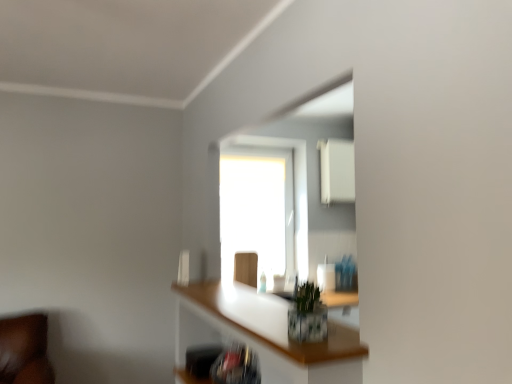
The image size is (512, 384). Find the location of `wooden swivel chair at center`. wooden swivel chair at center is located at coordinates [x=246, y=268].

Identify the location of transparent glass window at center. (258, 212).

At what (x,y) coordinates should I click in order to perform the action: click on wooden swivel chair at center. Please return your answer as a coordinate pair (x, y). The image size is (512, 384). Looking at the image, I should click on (246, 268).

Consider the image. Between translucent glass shelf at center and green leafy plant at center, which one has smaller size?

green leafy plant at center is smaller.

From the image's perspective, relative to green leafy plant at center, is translucent glass shelf at center above or below?

Based on their image positions, translucent glass shelf at center is located beneath green leafy plant at center.

In terms of height, does translucent glass shelf at center look taller or shorter compared to green leafy plant at center?

translucent glass shelf at center is taller than green leafy plant at center.

Between translucent glass shelf at center and green leafy plant at center, which one has smaller width?

With smaller width is green leafy plant at center.

Does wooden swivel chair at center appear on the left side of green leafy plant at center?

Correct, you'll find wooden swivel chair at center to the left of green leafy plant at center.

Looking at their sizes, would you say wooden swivel chair at center is wider or thinner than green leafy plant at center?

Considering their sizes, wooden swivel chair at center looks slimmer than green leafy plant at center.

The height and width of the screenshot is (384, 512). I want to click on plant that is in front of the wooden swivel chair at center, so click(x=307, y=315).

Looking at the image, does wooden swivel chair at center seem bigger or smaller compared to green leafy plant at center?

Considering their sizes, wooden swivel chair at center takes up more space than green leafy plant at center.

Which is more to the right, translucent glass shelf at center or transparent glass window at center?

From the viewer's perspective, translucent glass shelf at center appears more on the right side.

Is transparent glass window at center located within translucent glass shelf at center?

No, transparent glass window at center is not surrounded by translucent glass shelf at center.

Is translucent glass shelf at center turned away from transparent glass window at center?

No, translucent glass shelf at center's orientation is not away from transparent glass window at center.

Is translucent glass shelf at center thinner than transparent glass window at center?

No, translucent glass shelf at center is not thinner than transparent glass window at center.

Is green leafy plant at center in contact with translucent glass shelf at center?

No, green leafy plant at center is not next to translucent glass shelf at center.

Relative to translucent glass shelf at center, is green leafy plant at center in front or behind?

Clearly, green leafy plant at center is behind translucent glass shelf at center.

From the picture: From the image's perspective, is green leafy plant at center above translucent glass shelf at center?

Yes, from the image's perspective, green leafy plant at center is above translucent glass shelf at center.

Based on their sizes in the image, would you say green leafy plant at center is bigger or smaller than translucent glass shelf at center?

In the image, green leafy plant at center appears to be smaller than translucent glass shelf at center.

Is green leafy plant at center with transparent glass window at center?

No, green leafy plant at center is not next to transparent glass window at center.

Which of these two, green leafy plant at center or transparent glass window at center, is bigger?

With larger size is transparent glass window at center.

Considering the points (321, 309) and (277, 240), which point is in front, point (321, 309) or point (277, 240)?

The point (321, 309) is in front.

Considering the sizes of green leafy plant at center and transparent glass window at center in the image, is green leafy plant at center taller or shorter than transparent glass window at center?

In the image, green leafy plant at center appears to be shorter than transparent glass window at center.

Considering the positions of point (269, 258) and point (203, 322), is point (269, 258) closer or farther from the camera than point (203, 322)?

Point (269, 258) is farther from the camera than point (203, 322).

From the picture: Is transparent glass window at center facing away from translucent glass shelf at center?

transparent glass window at center does not have its back to translucent glass shelf at center.

Considering the positions of objects transparent glass window at center and translucent glass shelf at center in the image provided, who is more to the left, transparent glass window at center or translucent glass shelf at center?

Positioned to the left is transparent glass window at center.

How many degrees apart are the facing directions of transparent glass window at center and translucent glass shelf at center?

The angle between the facing direction of transparent glass window at center and the facing direction of translucent glass shelf at center is 90.7 degrees.

Would you say translucent glass shelf at center is a long distance from wooden swivel chair at center?

That's right, there is a large distance between translucent glass shelf at center and wooden swivel chair at center.

From the image's perspective, is translucent glass shelf at center located above wooden swivel chair at center?

No, from the image's perspective, translucent glass shelf at center is not above wooden swivel chair at center.

Locate an element on the screen. Image resolution: width=512 pixels, height=384 pixels. swivel chair that is above the translucent glass shelf at center (from the image's perspective) is located at coordinates (246, 268).

The height and width of the screenshot is (384, 512). I want to click on shelf located below the green leafy plant at center (from the image's perspective), so click(x=264, y=334).

Where is `swivel chair located underneath the green leafy plant at center (from a real-world perspective)`? swivel chair located underneath the green leafy plant at center (from a real-world perspective) is located at coordinates (246, 268).

From the image, which object appears to be farther from wooden swivel chair at center, translucent glass shelf at center or green leafy plant at center?

green leafy plant at center.

Which object lies nearer to the anchor point translucent glass shelf at center, wooden swivel chair at center or green leafy plant at center?

Answer: green leafy plant at center lies closer to translucent glass shelf at center than the other object.

Based on their spatial positions, is wooden swivel chair at center or transparent glass window at center further from translucent glass shelf at center?

transparent glass window at center lies further to translucent glass shelf at center than the other object.

Based on their spatial positions, is translucent glass shelf at center or transparent glass window at center closer to green leafy plant at center?

Based on the image, translucent glass shelf at center appears to be nearer to green leafy plant at center.

Looking at the image, which one is located further to transparent glass window at center, wooden swivel chair at center or translucent glass shelf at center?

translucent glass shelf at center lies further to transparent glass window at center than the other object.

Estimate the real-world distances between objects in this image. Which object is closer to wooden swivel chair at center, green leafy plant at center or transparent glass window at center?

transparent glass window at center.

Which object lies further to the anchor point wooden swivel chair at center, green leafy plant at center or translucent glass shelf at center?

green leafy plant at center lies further to wooden swivel chair at center than the other object.

Looking at the image, which one is located further to green leafy plant at center, wooden swivel chair at center or translucent glass shelf at center?

wooden swivel chair at center.

Locate an element on the screen. This screenshot has height=384, width=512. plant positioned between translucent glass shelf at center and wooden swivel chair at center from near to far is located at coordinates (307, 315).

What are the coordinates of `swivel chair positioned between green leafy plant at center and transparent glass window at center from near to far` in the screenshot? It's located at (246, 268).

Find the location of a particular element. plant positioned between translucent glass shelf at center and transparent glass window at center from near to far is located at coordinates (307, 315).

Locate an element on the screen. This screenshot has width=512, height=384. swivel chair positioned between translucent glass shelf at center and transparent glass window at center from near to far is located at coordinates (246, 268).